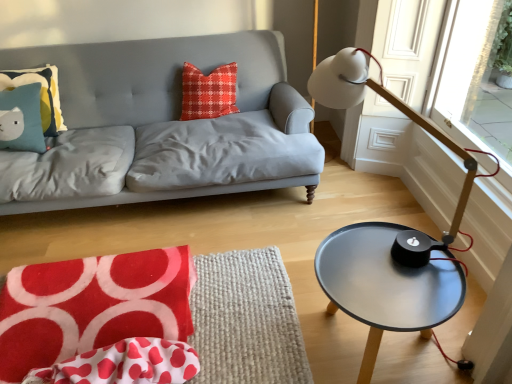
In order to click on free space above velvety red swivel chair at lower left (from a real-world perspective) in this screenshot , I will do `click(100, 315)`.